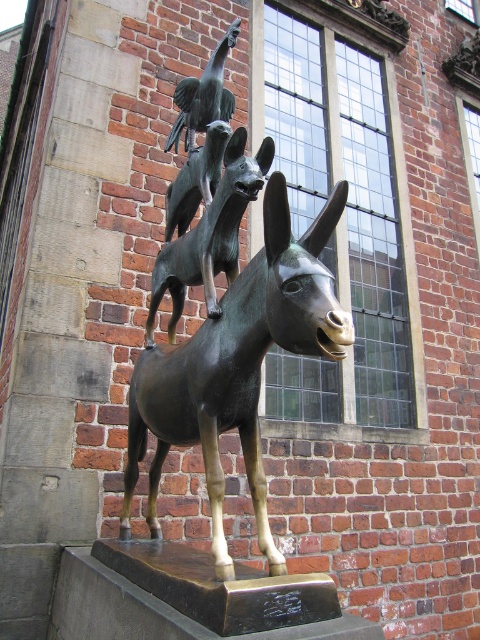
You are an art student observing the sculpture. You notice the bronze statue at upper center and the bronze bird at center. According to the sculpture, which object is positioned to the left?

The bronze bird at center is positioned to the left of the bronze statue at upper center.